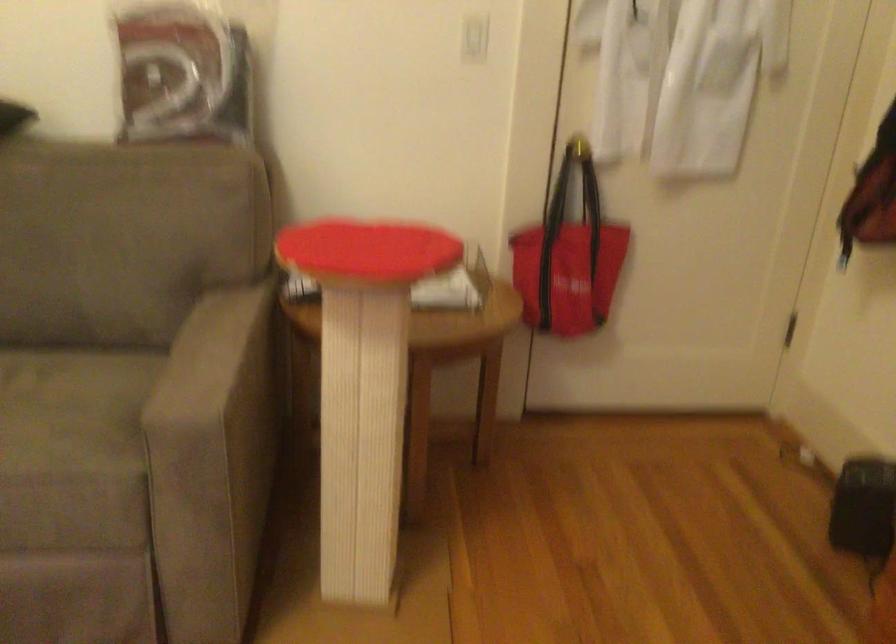
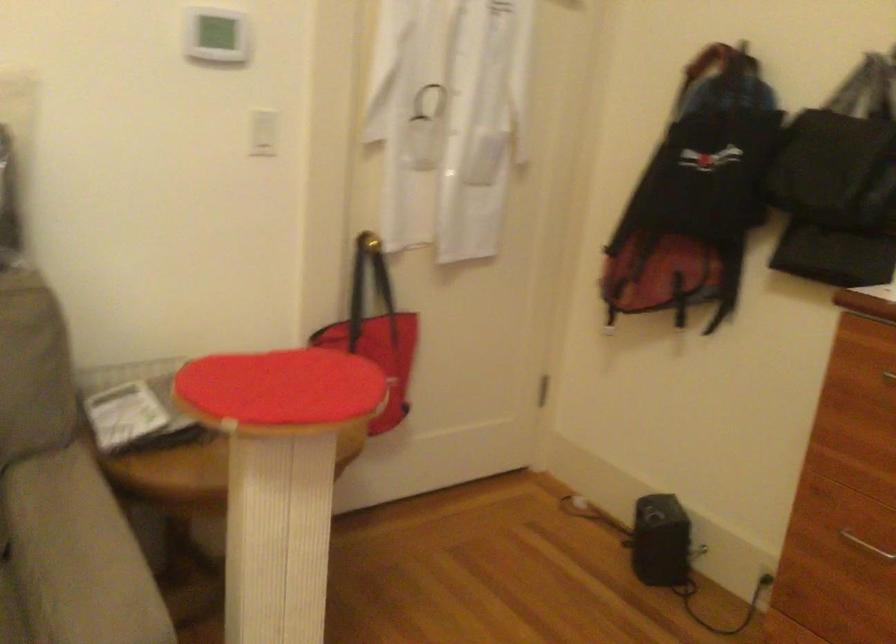
Question: The images are taken continuously from a first-person perspective. In which direction is your viewpoint rotating?

Choices:
 (A) Left
 (B) Right
 (C) Up
 (D) Down

Answer: (B)